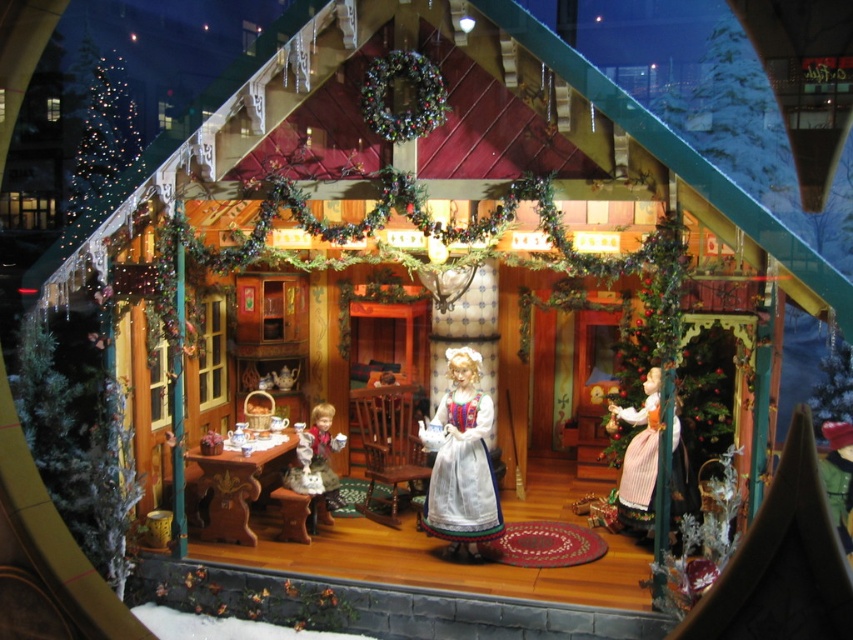
You are a guest in the miniature Christmas house and want to place a small gift under the table where the porcelain doll at lower left is located. However, you need to ensure that the gift won not block the view of the white porcelain doll at center from the entrance. Can you do this?

The white porcelain doll at center is above the porcelain doll at lower left, so placing the gift under the table where the porcelain doll at lower left is located would not block the view of the white porcelain doll at center since it is positioned higher up.

You are a guest at the Christmas party inside the miniature house. You see a white porcelain doll at center and a porcelain doll at lower left. Which doll is closer to you?

The white porcelain doll at center is closer to you because it is in front of the porcelain doll at lower left.